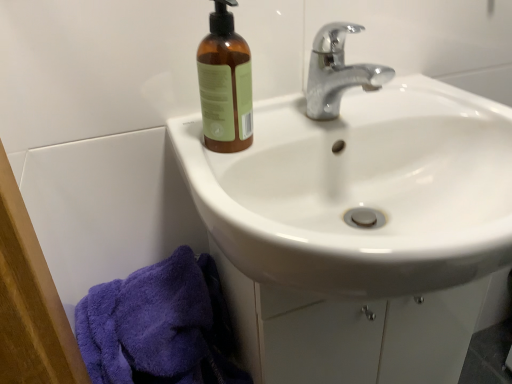
This screenshot has width=512, height=384. What do you see at coordinates (360, 184) in the screenshot?
I see `white glossy sink at upper center` at bounding box center [360, 184].

What do you see at coordinates (225, 83) in the screenshot?
I see `brown glass bottle at upper left` at bounding box center [225, 83].

Measure the distance between purple fluffy towel at lower left and camera.

The distance of purple fluffy towel at lower left from camera is 23.18 inches.

Locate an element on the screen. This screenshot has width=512, height=384. white glossy sink at upper center is located at coordinates (360, 184).

In the scene shown: Is brown glass bottle at upper left next to chrome metallic faucet at upper center?

No, brown glass bottle at upper left is not making contact with chrome metallic faucet at upper center.

Which of these two, brown glass bottle at upper left or chrome metallic faucet at upper center, is bigger?

With larger size is chrome metallic faucet at upper center.

Can you confirm if brown glass bottle at upper left is taller than chrome metallic faucet at upper center?

Yes.

Which is behind, brown glass bottle at upper left or chrome metallic faucet at upper center?

brown glass bottle at upper left is behind.

Considering the relative sizes of chrome metallic faucet at upper center and purple fluffy towel at lower left in the image provided, is chrome metallic faucet at upper center taller than purple fluffy towel at lower left?

Incorrect, the height of chrome metallic faucet at upper center is not larger of that of purple fluffy towel at lower left.

From a real-world perspective, which is physically above, chrome metallic faucet at upper center or purple fluffy towel at lower left?

chrome metallic faucet at upper center.

Does point (334, 50) come closer to viewer compared to point (226, 323)?

Yes, point (334, 50) is in front of point (226, 323).

Is chrome metallic faucet at upper center facing towards purple fluffy towel at lower left?

No, chrome metallic faucet at upper center is not facing towards purple fluffy towel at lower left.

Is chrome metallic faucet at upper center not close to brown glass bottle at upper left?

They are positioned close to each other.

In terms of size, does chrome metallic faucet at upper center appear bigger or smaller than brown glass bottle at upper left?

In the image, chrome metallic faucet at upper center appears to be larger than brown glass bottle at upper left.

Locate an element on the screen. bottle on the left of chrome metallic faucet at upper center is located at coordinates (225, 83).

Does chrome metallic faucet at upper center have a greater width compared to brown glass bottle at upper left?

Indeed, chrome metallic faucet at upper center has a greater width compared to brown glass bottle at upper left.

The height and width of the screenshot is (384, 512). I want to click on tap behind the purple fluffy towel at lower left, so click(x=337, y=72).

From a real-world perspective, which object stands above the other?

From a 3D spatial view, chrome metallic faucet at upper center is above.

Which is farther, (158, 283) or (332, 41)?

Positioned behind is point (332, 41).

Considering the positions of objects purple fluffy towel at lower left and chrome metallic faucet at upper center in the image provided, who is more to the left, purple fluffy towel at lower left or chrome metallic faucet at upper center?

Positioned to the left is purple fluffy towel at lower left.

From a real-world perspective, is purple fluffy towel at lower left located higher than brown glass bottle at upper left?

No.

Which is less distant, (101,349) or (230,144)?

Point (101,349) appears to be farther away from the viewer than point (230,144).

Is purple fluffy towel at lower left turned away from brown glass bottle at upper left?

purple fluffy towel at lower left is not turned away from brown glass bottle at upper left.

Looking at this image, can you confirm if brown glass bottle at upper left is smaller than white glossy sink at upper center?

Yes.

Is white glossy sink at upper center at the back of brown glass bottle at upper left?

brown glass bottle at upper left is not turned away from white glossy sink at upper center.

Locate an element on the screen. This screenshot has height=384, width=512. sink on the right of the brown glass bottle at upper left is located at coordinates click(x=360, y=184).

How far apart are brown glass bottle at upper left and white glossy sink at upper center?

The distance of brown glass bottle at upper left from white glossy sink at upper center is 7.65 inches.

From a real-world perspective, which object rests below the other?

white glossy sink at upper center, from a real-world perspective.

Is white glossy sink at upper center taller or shorter than chrome metallic faucet at upper center?

Clearly, white glossy sink at upper center is taller compared to chrome metallic faucet at upper center.

Are white glossy sink at upper center and chrome metallic faucet at upper center beside each other?

white glossy sink at upper center is not next to chrome metallic faucet at upper center, and they're not touching.

Considering the positions of objects white glossy sink at upper center and chrome metallic faucet at upper center in the image provided, who is more to the left, white glossy sink at upper center or chrome metallic faucet at upper center?

chrome metallic faucet at upper center.

Where is `tap in front of the brown glass bottle at upper left`? This screenshot has height=384, width=512. tap in front of the brown glass bottle at upper left is located at coordinates (337, 72).

The height and width of the screenshot is (384, 512). I want to click on tap that appears behind the purple fluffy towel at lower left, so click(337, 72).

From the image, which object appears to be farther from purple fluffy towel at lower left, brown glass bottle at upper left or chrome metallic faucet at upper center?

chrome metallic faucet at upper center.

Consider the image. From the image, which object appears to be nearer to white glossy sink at upper center, brown glass bottle at upper left or chrome metallic faucet at upper center?

chrome metallic faucet at upper center is closer to white glossy sink at upper center.

From the image, which object appears to be nearer to chrome metallic faucet at upper center, brown glass bottle at upper left or white glossy sink at upper center?

white glossy sink at upper center is positioned closer to the anchor chrome metallic faucet at upper center.

Estimate the real-world distances between objects in this image. Which object is closer to purple fluffy towel at lower left, brown glass bottle at upper left or white glossy sink at upper center?

brown glass bottle at upper left is closer to purple fluffy towel at lower left.

From the image, which object appears to be nearer to white glossy sink at upper center, chrome metallic faucet at upper center or purple fluffy towel at lower left?

chrome metallic faucet at upper center lies closer to white glossy sink at upper center than the other object.

Looking at the image, which one is located closer to chrome metallic faucet at upper center, purple fluffy towel at lower left or brown glass bottle at upper left?

The object closer to chrome metallic faucet at upper center is brown glass bottle at upper left.

When comparing their distances from chrome metallic faucet at upper center, does white glossy sink at upper center or purple fluffy towel at lower left seem further?

Among the two, purple fluffy towel at lower left is located further to chrome metallic faucet at upper center.

Considering their positions, is purple fluffy towel at lower left positioned closer to chrome metallic faucet at upper center than white glossy sink at upper center?

white glossy sink at upper center is positioned closer to the anchor chrome metallic faucet at upper center.

Where is `tap situated between brown glass bottle at upper left and white glossy sink at upper center from left to right`? tap situated between brown glass bottle at upper left and white glossy sink at upper center from left to right is located at coordinates (337, 72).

Locate an element on the screen. This screenshot has width=512, height=384. sink between chrome metallic faucet at upper center and purple fluffy towel at lower left in the up-down direction is located at coordinates (360, 184).

Locate an element on the screen. bottle between chrome metallic faucet at upper center and purple fluffy towel at lower left from top to bottom is located at coordinates (225, 83).

The width and height of the screenshot is (512, 384). What are the coordinates of `sink that lies between brown glass bottle at upper left and purple fluffy towel at lower left from top to bottom` in the screenshot? It's located at (360, 184).